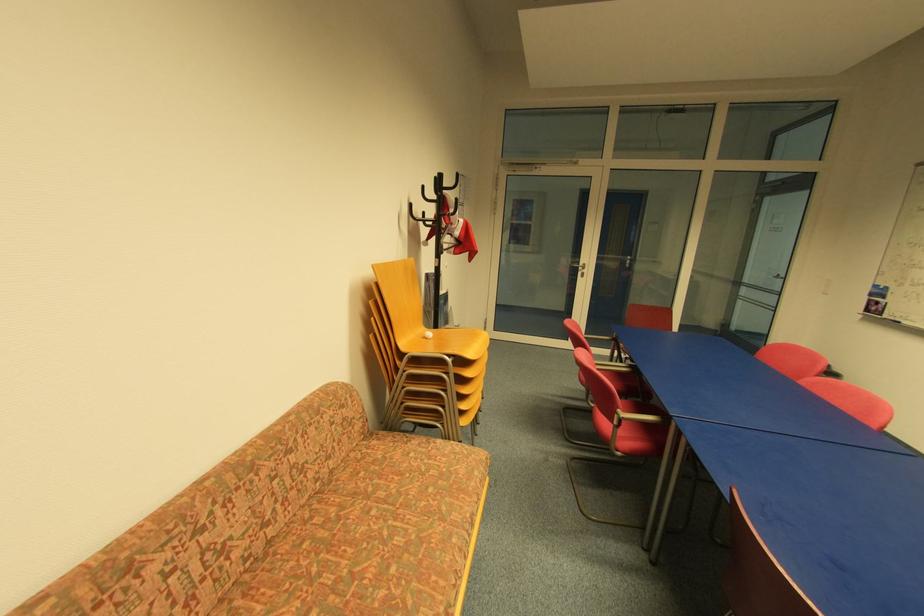
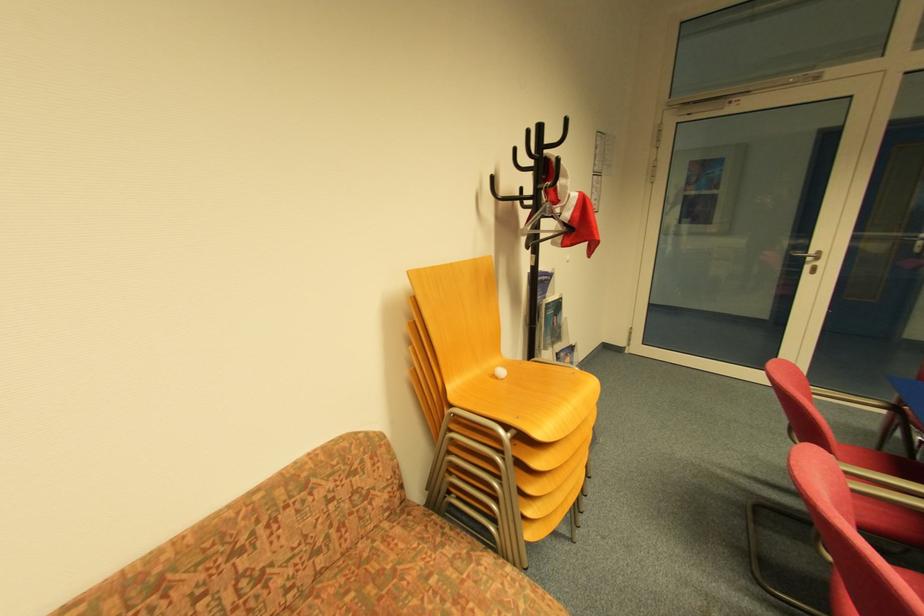
Question: Based on the continuous images, in which direction is the camera rotating? Reply with the corresponding letter.

Choices:
 (A) Left
 (B) Right
 (C) Up
 (D) Down

Answer: (A)